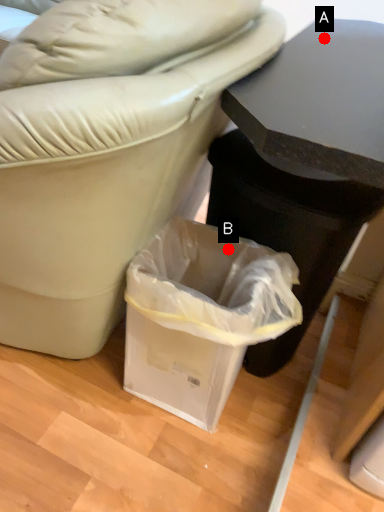
Question: Two points are circled on the image, labeled by A and B beside each circle. Among these points, which one is nearest to the camera?

Choices:
 (A) A is closer
 (B) B is closer

Answer: (B)